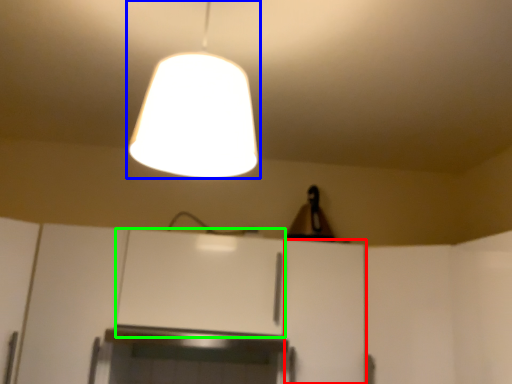
Question: Which object is positioned farthest from cabinetry (highlighted by a red box)? Select from lamp (highlighted by a blue box) and cabinetry (highlighted by a green box).

Choices:
 (A) lamp
 (B) cabinetry

Answer: (A)